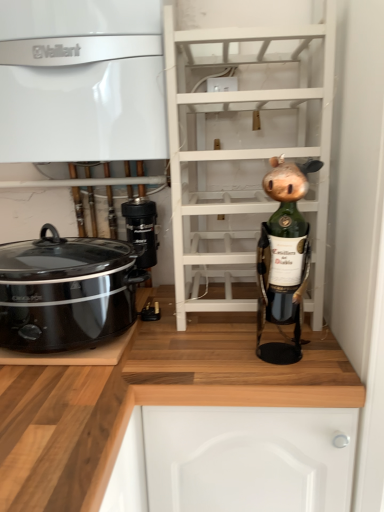
This screenshot has height=512, width=384. I want to click on free space on the front side of green matte wine bottle at right, so click(x=296, y=381).